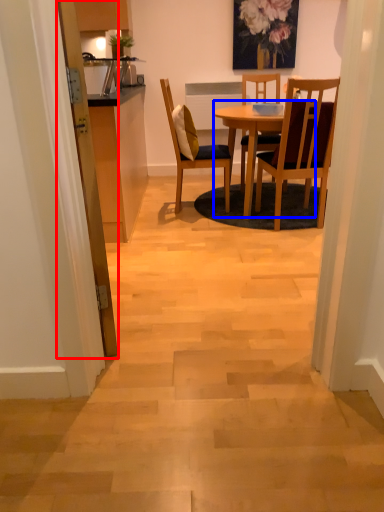
Question: Which object is further to the camera taking this photo, door (highlighted by a red box) or round table (highlighted by a blue box)?

Choices:
 (A) door
 (B) round table

Answer: (B)